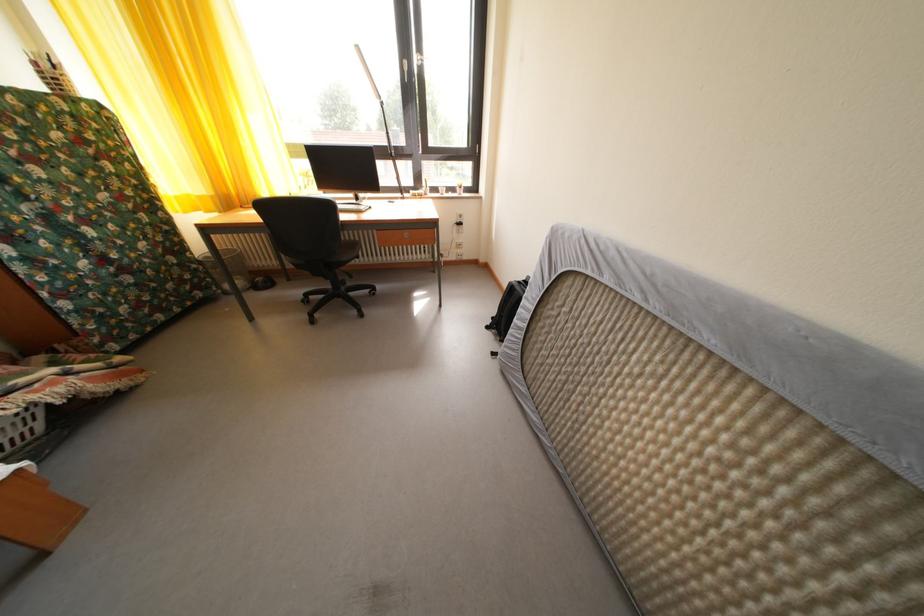
Identify the location of black chair sitting surface. The height and width of the screenshot is (616, 924). (348, 248).